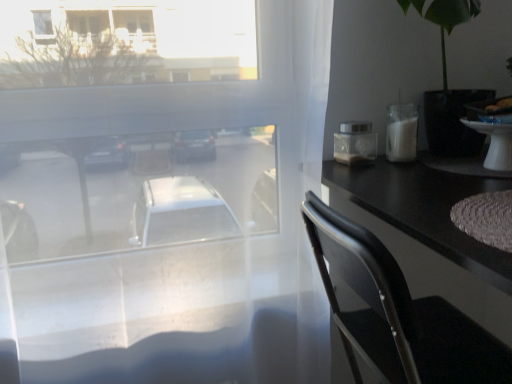
Question: Is white glossy table at right further to the viewer compared to black plastic chair at right?

Choices:
 (A) no
 (B) yes

Answer: (B)

Question: Is white glossy table at right looking in the opposite direction of black plastic chair at right?

Choices:
 (A) no
 (B) yes

Answer: (A)

Question: Does white glossy table at right appear on the left side of black plastic chair at right?

Choices:
 (A) yes
 (B) no

Answer: (B)

Question: Is white glossy table at right outside black plastic chair at right?

Choices:
 (A) no
 (B) yes

Answer: (B)

Question: Is white glossy table at right far away from black plastic chair at right?

Choices:
 (A) no
 (B) yes

Answer: (A)

Question: Can you confirm if white glossy table at right is thinner than black plastic chair at right?

Choices:
 (A) no
 (B) yes

Answer: (B)

Question: Considering the relative positions of white glossy table at right and transparent glass window at center in the image provided, is white glossy table at right to the right of transparent glass window at center from the viewer's perspective?

Choices:
 (A) no
 (B) yes

Answer: (B)

Question: From a real-world perspective, is white glossy table at right below transparent glass window at center?

Choices:
 (A) no
 (B) yes

Answer: (A)

Question: Can you confirm if white glossy table at right is thinner than transparent glass window at center?

Choices:
 (A) no
 (B) yes

Answer: (B)

Question: Are white glossy table at right and transparent glass window at center located far from each other?

Choices:
 (A) yes
 (B) no

Answer: (B)

Question: Would you say white glossy table at right is outside transparent glass window at center?

Choices:
 (A) no
 (B) yes

Answer: (B)

Question: Considering the relative sizes of white glossy table at right and transparent glass window at center in the image provided, is white glossy table at right taller than transparent glass window at center?

Choices:
 (A) yes
 (B) no

Answer: (B)

Question: Considering the relative positions of transparent glass window at center and black plastic chair at right in the image provided, is transparent glass window at center to the right of black plastic chair at right from the viewer's perspective?

Choices:
 (A) no
 (B) yes

Answer: (A)